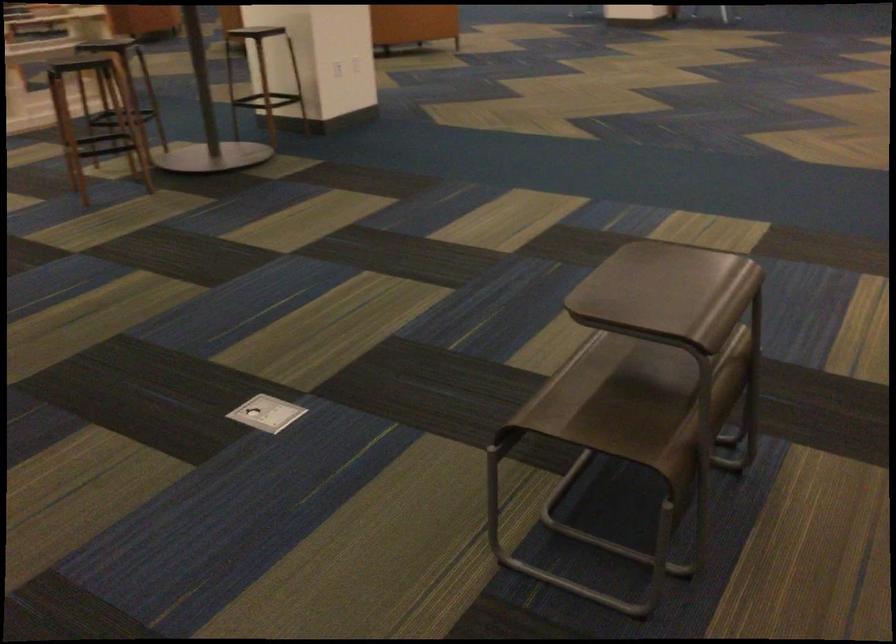
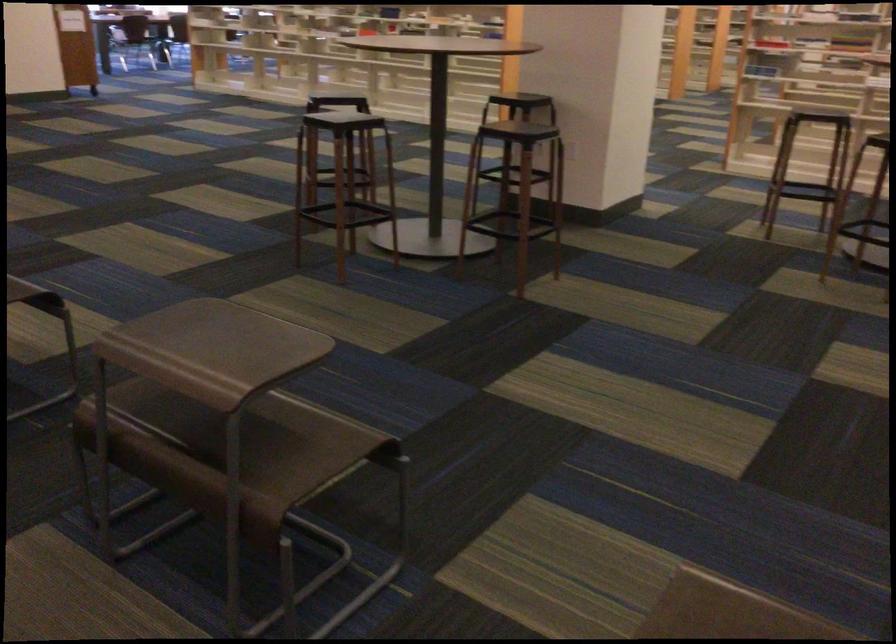
First-person continuous shooting, in which direction is the camera rotating?

The camera rotated toward left-down.